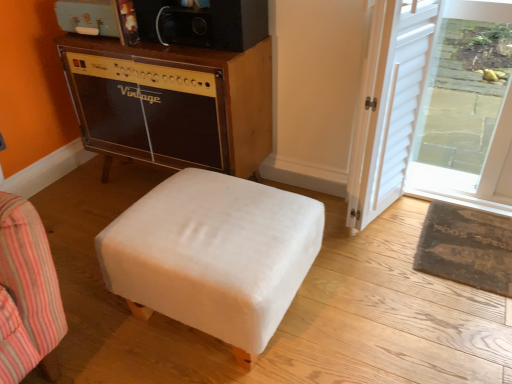
Find the location of a particular element. This screenshot has height=384, width=512. vacant space situated on the left part of rustic brown mat at lower right is located at coordinates (380, 251).